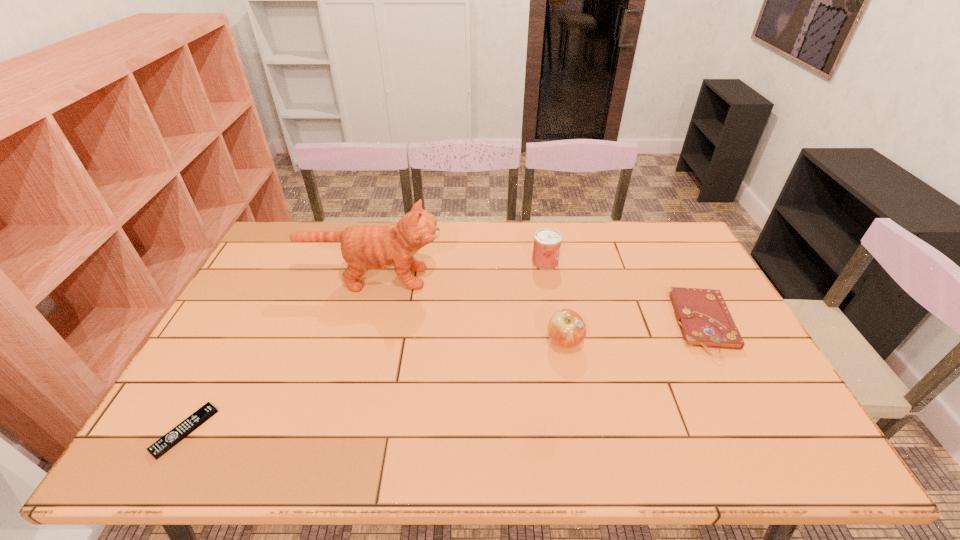
You are a GUI agent. You are given a task and a screenshot of the screen. Output one action in this format:
    pyautogui.click(x=<x>, y=<y>)
    Task: Click on the second object from left to right
    The image size is (960, 540).
    Given the screenshot: What is the action you would take?
    pyautogui.click(x=373, y=247)

You are a GUI agent. You are given a task and a screenshot of the screen. Output one action in this format:
    pyautogui.click(x=<x>, y=<y>)
    Task: Click on the cat
    
    Given the screenshot: What is the action you would take?
    pyautogui.click(x=373, y=247)

At what (x,y) coordinates should I click in order to perform the action: click on can. Please return your answer as a coordinate pair (x, y). Image resolution: width=960 pixels, height=540 pixels. Looking at the image, I should click on (547, 242).

Find the location of a particular element. The image size is (960, 540). apple is located at coordinates (566, 328).

Identify the location of the rightmost object. (704, 319).

At what (x,y) coordinates should I click in order to perform the action: click on notebook. Please return your answer as a coordinate pair (x, y). Looking at the image, I should click on (704, 319).

Image resolution: width=960 pixels, height=540 pixels. In order to click on the leftmost object in this screenshot , I will do `click(164, 444)`.

This screenshot has height=540, width=960. What are the coordinates of `remote control` in the screenshot? It's located at (164, 444).

You are a GUI agent. You are given a task and a screenshot of the screen. Output one action in this format:
    pyautogui.click(x=<x>, y=<y>)
    Task: Click on the vacant space located 0.280m on the face of the fourth object from right to left
    The image size is (960, 540).
    Given the screenshot: What is the action you would take?
    pyautogui.click(x=529, y=278)

At what (x,y) coordinates should I click in order to perform the action: click on free space located 0.130m on the back of the can. Please return your answer as a coordinate pair (x, y). This screenshot has height=540, width=960. Looking at the image, I should click on click(540, 233).